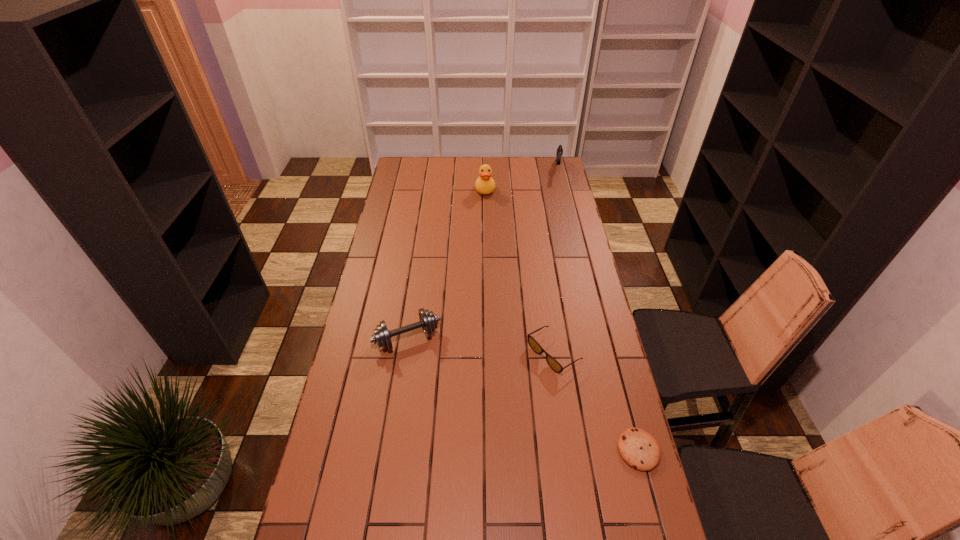
You are a GUI agent. You are given a task and a screenshot of the screen. Output one action in this format:
    pyautogui.click(x=<x>, y=<y>)
    Task: Click on the vacant space on the desktop that is between the third tallest object and the nearest object and is positioned on the front-facing side of the fourth tallest object
    This screenshot has width=960, height=540.
    Given the screenshot: What is the action you would take?
    pyautogui.click(x=505, y=386)

Image resolution: width=960 pixels, height=540 pixels. In order to click on free space on the desktop that is between the dumbbell and the nearest object and is positioned at the beak of the duck in this screenshot , I will do `click(500, 383)`.

You are a GUI agent. You are given a task and a screenshot of the screen. Output one action in this format:
    pyautogui.click(x=<x>, y=<y>)
    Task: Click on the free space on the desktop that is between the leftmost object and the cookie and is positioned at the end of the barrel of the farthest object
    The image size is (960, 540).
    Given the screenshot: What is the action you would take?
    [x=531, y=398]